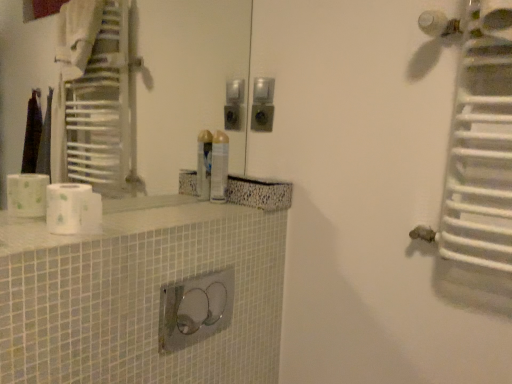
Where is `free spot in front of metallic silver spray can at center`? free spot in front of metallic silver spray can at center is located at coordinates (200, 209).